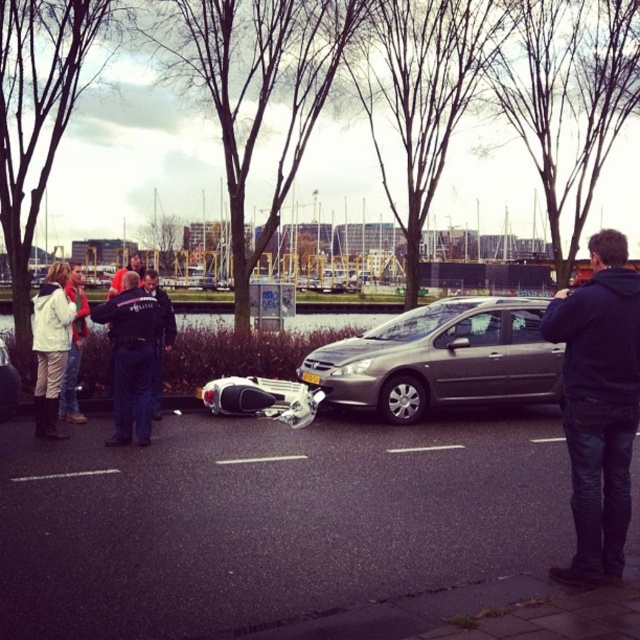
You are a photographer assigned to document the accident scene. You need to take a photo of the black uniformed officer at center while standing at the camera position. Considering the distance between them, is it feasible to capture the officer clearly in the photo without moving closer?

The black uniformed officer at center and camera are 29.28 feet apart from each other. At this distance, a standard camera can easily capture the officer clearly without needing to move closer.

You are a pedestrian on the sidewalk near the waterfront. You see the black uniformed officer at center and the white matte jacket at left. Which one appears larger in size?

The black uniformed officer at center is bigger than the white matte jacket at left, so the officer appears larger.

You are a pedestrian who just arrived at the scene of the accident. You see the black uniformed officer at center and the metallic silver motorcycle at lower left. Which object is closer to you?

The black uniformed officer at center is larger in size than the metallic silver motorcycle at lower left, so the officer is closer to you.